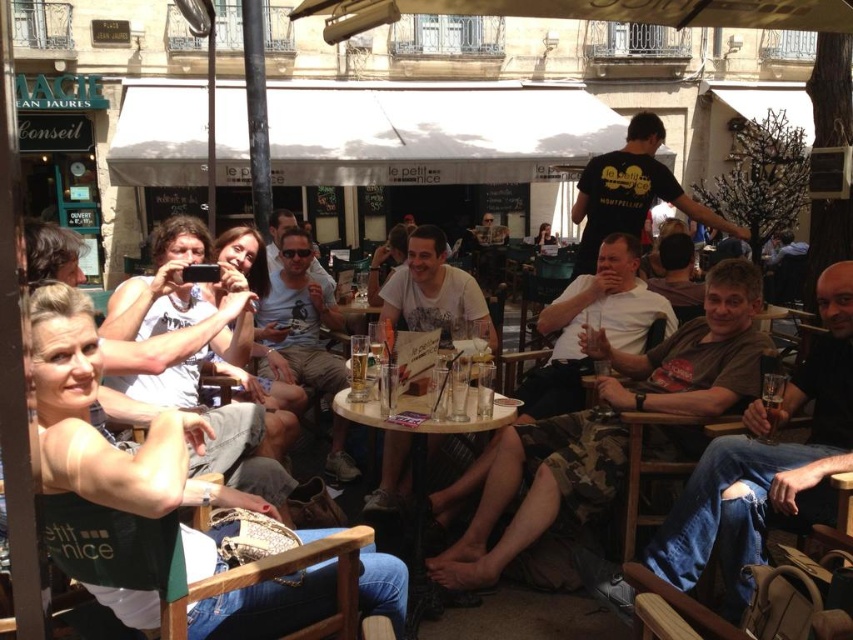
Does camouflage pants at center have a greater height compared to translucent glass table at center?

Yes.

This screenshot has width=853, height=640. What are the coordinates of `camouflage pants at center` in the screenshot? It's located at (608, 426).

Which is above, translucent glass table at center or translucent glass beverage at lower right?

Positioned higher is translucent glass beverage at lower right.

In the scene shown: Between translucent glass table at center and translucent glass beverage at lower right, which one has less height?

With less height is translucent glass table at center.

Between point (514, 417) and point (775, 412), which one is positioned behind?

The point (514, 417) is behind.

Where is `translucent glass table at center`? translucent glass table at center is located at coordinates (469, 420).

Is black t-shirt at upper center shorter than translucent glass table at center?

No.

Can you confirm if black t-shirt at upper center is positioned to the right of translucent glass table at center?

Indeed, black t-shirt at upper center is positioned on the right side of translucent glass table at center.

Does point (640, 150) come behind point (426, 419)?

Yes.

At what (x,y) coordinates should I click in order to perform the action: click on black t-shirt at upper center. Please return your answer as a coordinate pair (x, y). Looking at the image, I should click on (631, 192).